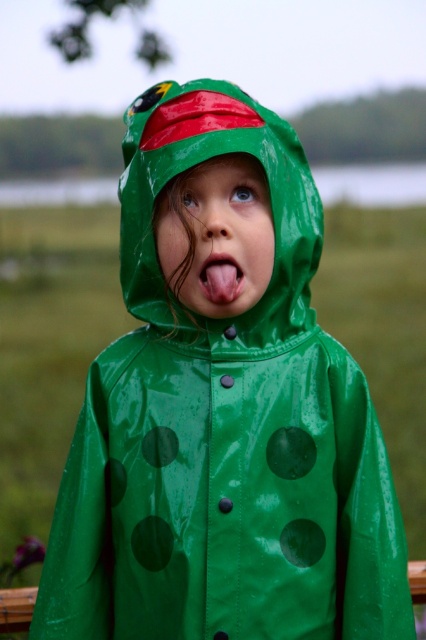
I want to click on green rubber raincoat at center, so click(x=201, y=161).

Does point (276, 173) come closer to viewer compared to point (227, 260)?

No, (276, 173) is further to viewer.

The width and height of the screenshot is (426, 640). Identify the location of green rubber raincoat at center. (201, 161).